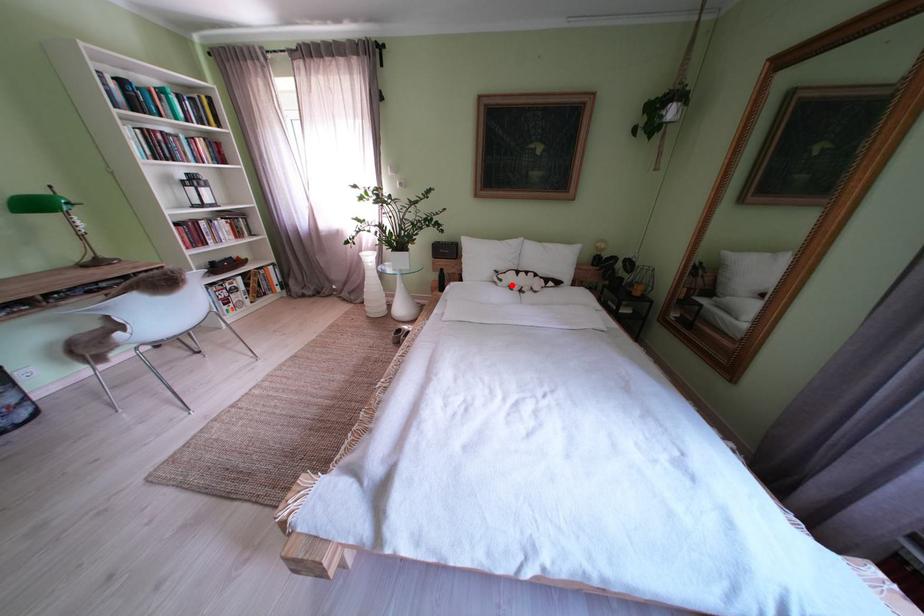
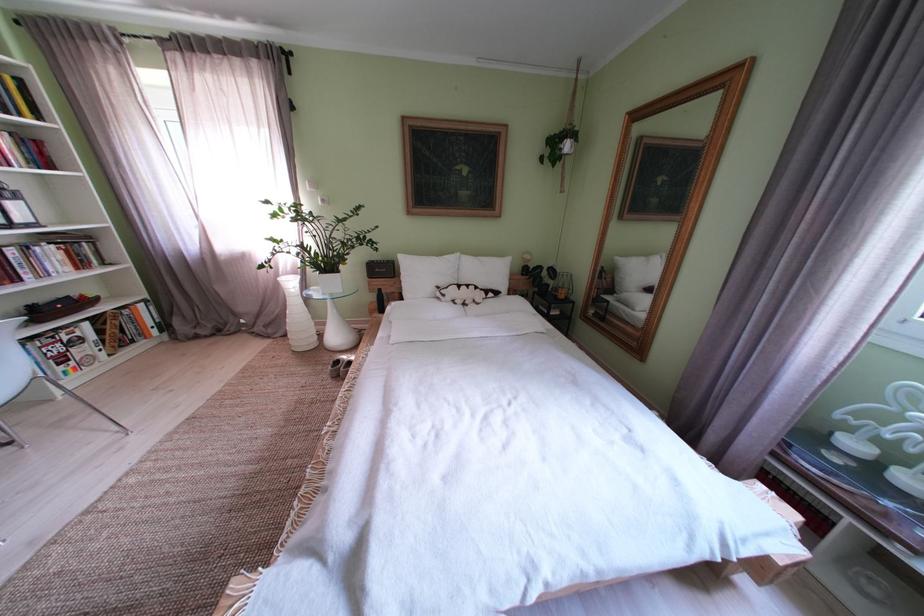
Where in the second image is the point corresponding to the highlighted location from the first image?

(455, 301)